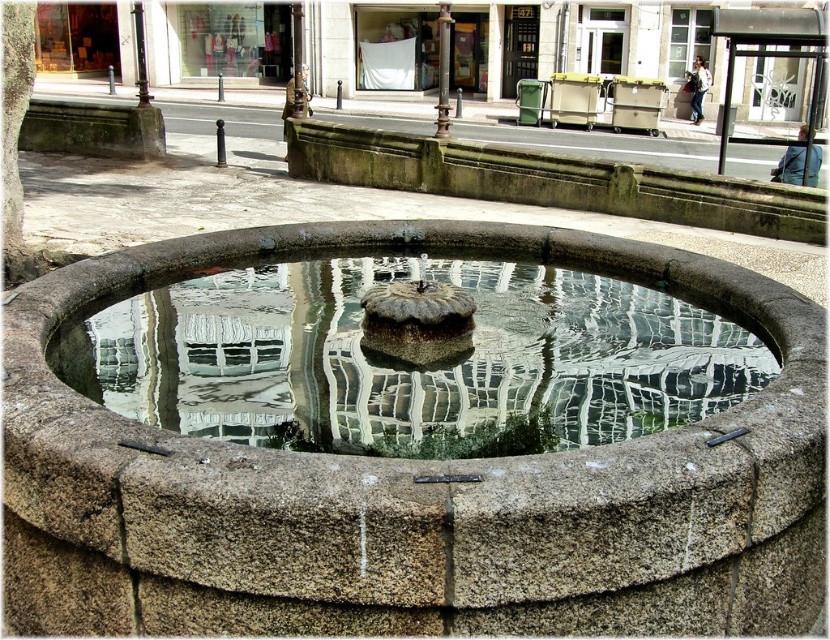
Question: Which point is closer to the camera?

Choices:
 (A) granite fountain at center
 (B) clear glass water at center

Answer: (A)

Question: Is granite fountain at center behind clear glass water at center?

Choices:
 (A) no
 (B) yes

Answer: (A)

Question: Can you confirm if granite fountain at center is positioned below clear glass water at center?

Choices:
 (A) no
 (B) yes

Answer: (B)

Question: Among these points, which one is nearest to the camera?

Choices:
 (A) (286, 496)
 (B) (134, 340)

Answer: (A)

Question: Does granite fountain at center have a greater width compared to clear glass water at center?

Choices:
 (A) yes
 (B) no

Answer: (A)